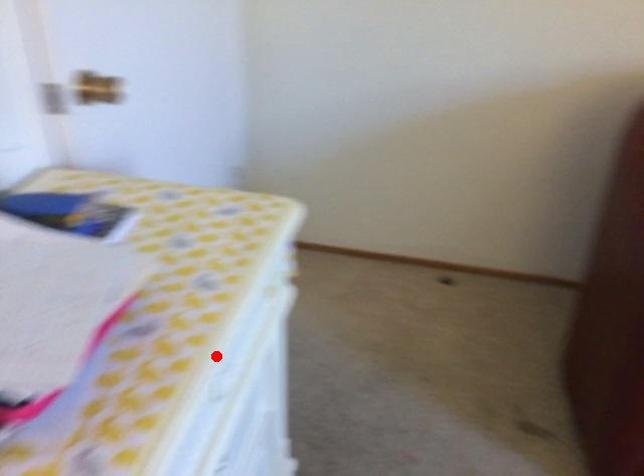
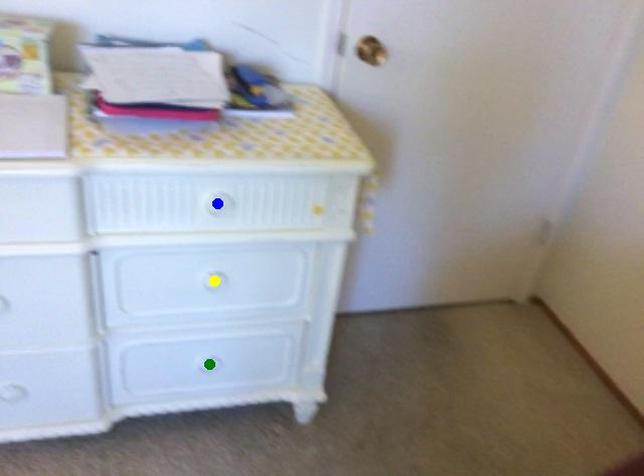
Question: I am providing you with two images of the same scene from different viewpoints. A red point is marked on the first image. You are given multiple points on the second image. Which point in image 2 is actually the same real-world point as the red point in image 1?

Choices:
 (A) blue point
 (B) yellow point
 (C) green point

Answer: (A)